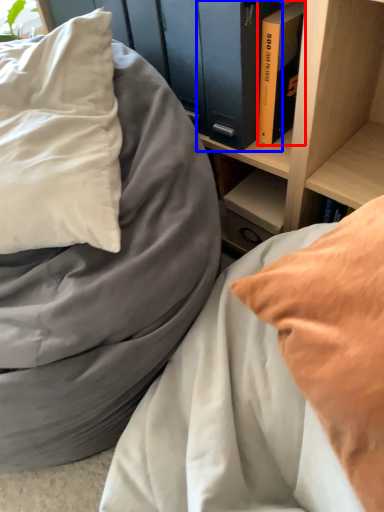
Question: Which of the following is the farthest to the observer, book (highlighted by a red box) or paperback book (highlighted by a blue box)?

Choices:
 (A) book
 (B) paperback book

Answer: (A)